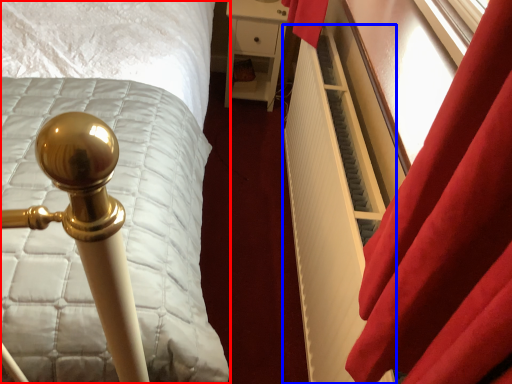
Question: Which of the following is the closest to the observer, bed (highlighted by a red box) or radiator (highlighted by a blue box)?

Choices:
 (A) bed
 (B) radiator

Answer: (B)